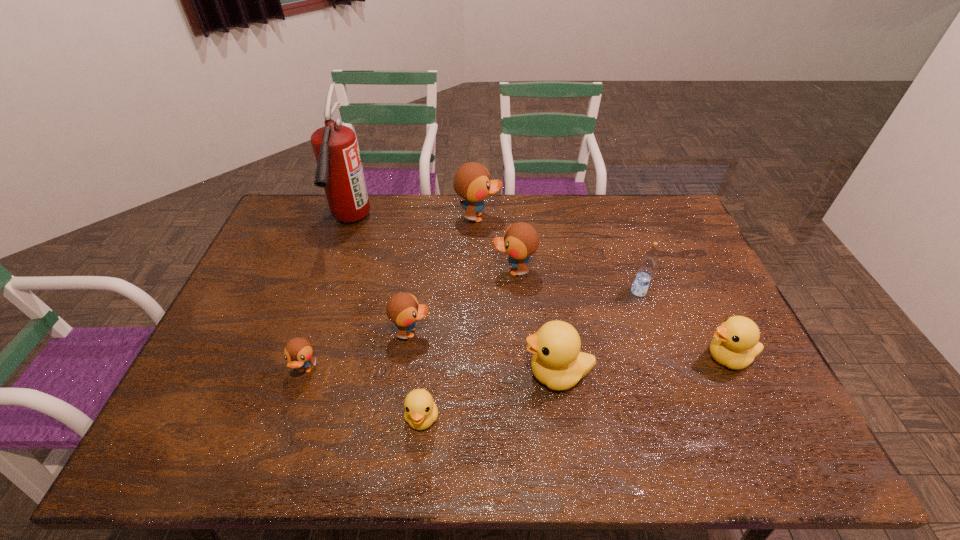
Identify the location of free space in the image that satisfies the following two spatial constraints: 1. on the face of the rightmost yellow duck; 2. on the face of the nearest yellow duck. The width and height of the screenshot is (960, 540). (756, 417).